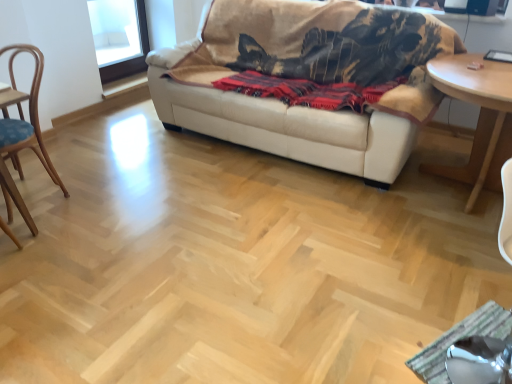
Where is `vacant area that lies to the right of wooden chair at left`? The height and width of the screenshot is (384, 512). vacant area that lies to the right of wooden chair at left is located at coordinates (96, 199).